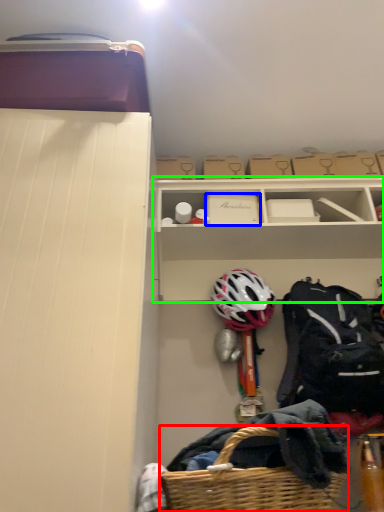
Question: Which is nearer to the picnic basket (highlighted by a red box)? storage box (highlighted by a blue box) or shelf (highlighted by a green box).

Choices:
 (A) storage box
 (B) shelf

Answer: (B)